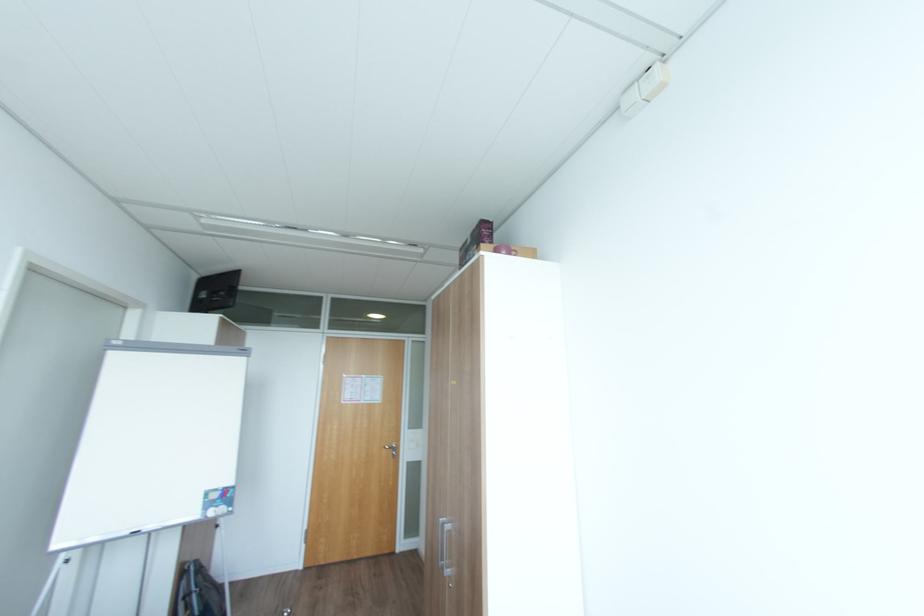
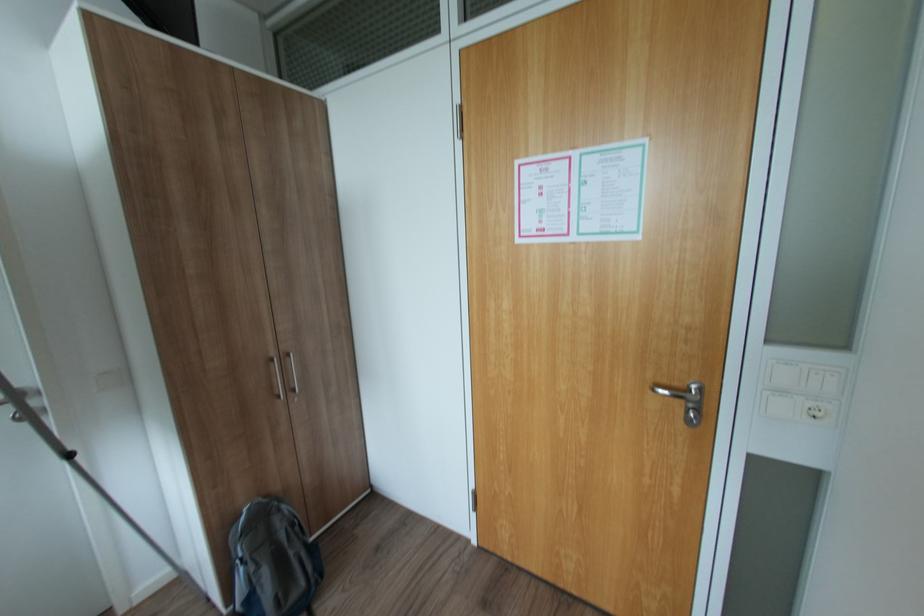
Find the pixel in the second image that matches point (392, 448) in the first image.

(664, 390)